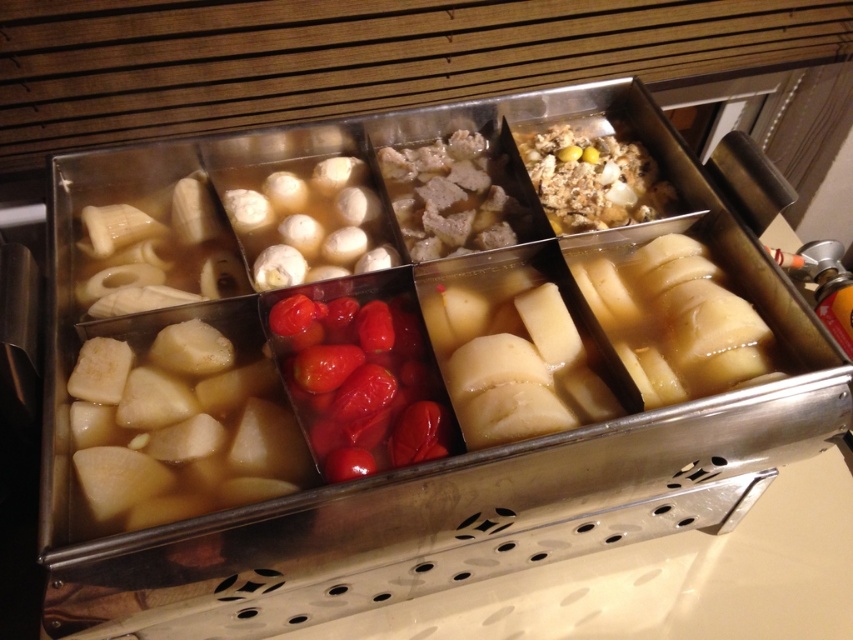
What do you see at coordinates (360, 384) in the screenshot?
I see `shiny red tomatoes at center` at bounding box center [360, 384].

Is shiny red tomatoes at center to the right of brown meat at center from the viewer's perspective?

In fact, shiny red tomatoes at center is to the left of brown meat at center.

Is point (367, 381) closer to viewer compared to point (485, 182)?

Yes, point (367, 381) is in front of point (485, 182).

I want to click on shiny red tomatoes at center, so click(x=360, y=384).

Does white translucent potatoes at lower left have a greater width compared to translucent white potato at right?

Correct, the width of white translucent potatoes at lower left exceeds that of translucent white potato at right.

Can you confirm if white translucent potatoes at lower left is smaller than translucent white potato at right?

No, white translucent potatoes at lower left is not smaller than translucent white potato at right.

Does point (236, 497) lie in front of point (585, 273)?

Yes, point (236, 497) is closer to viewer.

The image size is (853, 640). What are the coordinates of `white translucent potatoes at lower left` in the screenshot? It's located at (178, 428).

Does translucent white potato at right have a greater width compared to white matte dumplings at center?

No, translucent white potato at right is not wider than white matte dumplings at center.

Is the position of translucent white potato at right more distant than that of white matte dumplings at center?

No, translucent white potato at right is closer to the viewer.

At what (x,y) coordinates should I click in order to perform the action: click on translucent white potato at right. Please return your answer as a coordinate pair (x, y). The height and width of the screenshot is (640, 853). Looking at the image, I should click on (676, 321).

Locate an element on the screen. The height and width of the screenshot is (640, 853). translucent white potato at right is located at coordinates (676, 321).